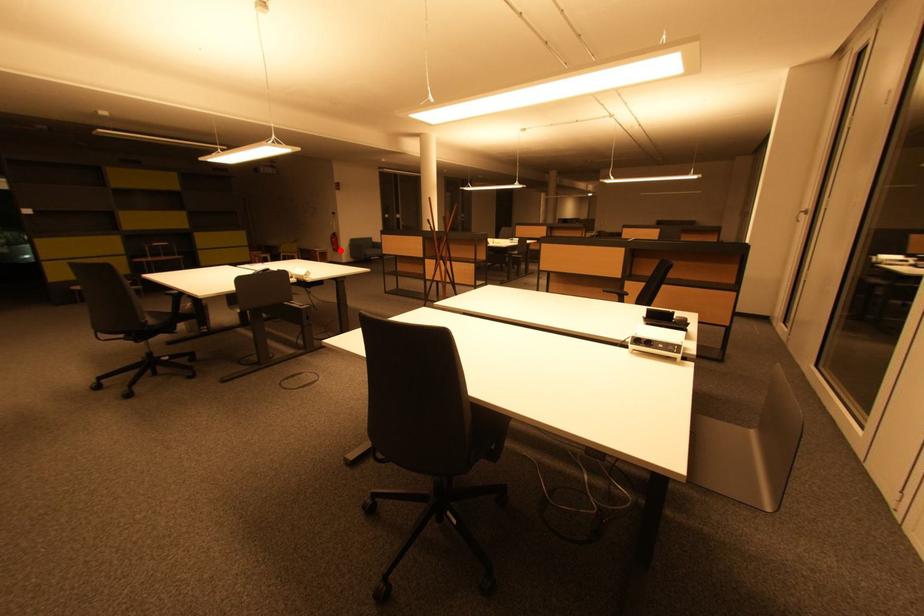
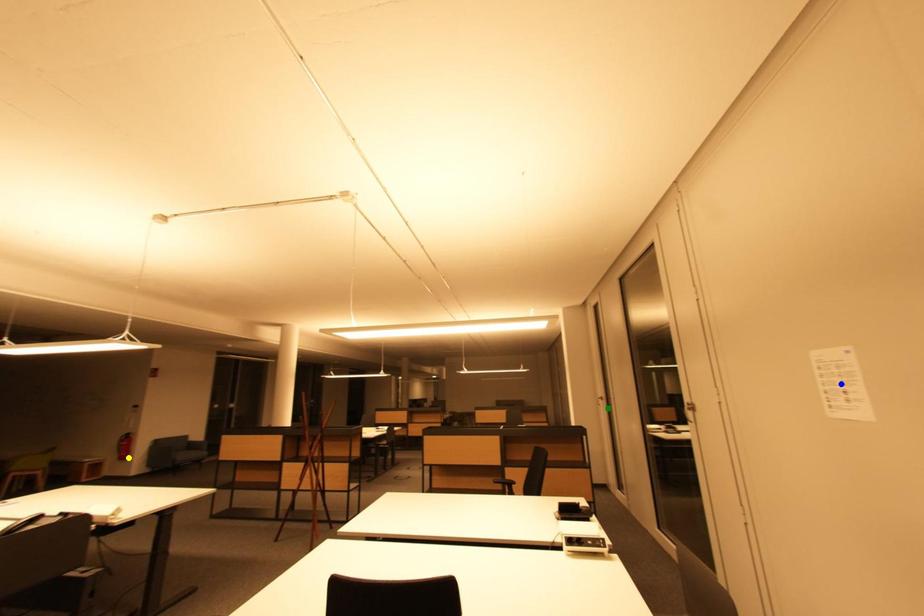
Question: I am providing you with two images of the same scene from different viewpoints. A red point is marked on the first image. You are given multiple points on the second image. Which point in image 2 is actually the same real-world point as the red point in image 1?

Choices:
 (A) green point
 (B) blue point
 (C) yellow point

Answer: (C)